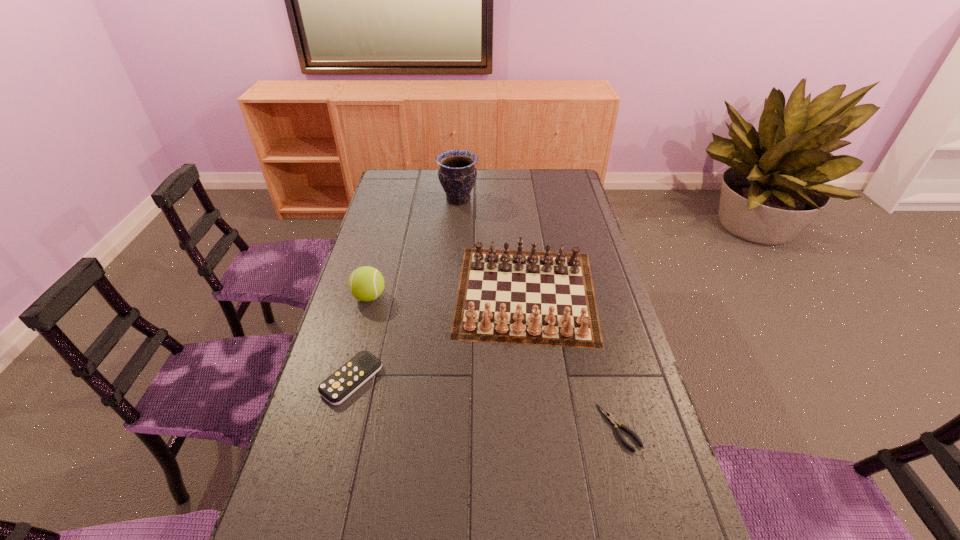
Locate an element on the screen. The height and width of the screenshot is (540, 960). vacant space located 0.080m on the back of the shortest object is located at coordinates (607, 379).

At what (x,y) coordinates should I click in order to perform the action: click on object situated at the far edge. Please return your answer as a coordinate pair (x, y). This screenshot has width=960, height=540. Looking at the image, I should click on (457, 174).

Identify the location of tennis ball that is at the left edge. This screenshot has width=960, height=540. (366, 283).

Locate an element on the screen. The width and height of the screenshot is (960, 540). remote control located in the left edge section of the desktop is located at coordinates (352, 375).

Locate an element on the screen. This screenshot has height=540, width=960. chessboard that is positioned at the right edge is located at coordinates (540, 299).

This screenshot has width=960, height=540. I want to click on pliers that is at the right edge, so click(613, 421).

Locate an element on the screen. The image size is (960, 540). vacant space at the left edge is located at coordinates (404, 222).

You are a GUI agent. You are given a task and a screenshot of the screen. Output one action in this format:
    pyautogui.click(x=<x>, y=<y>)
    Task: Click on the free point at the right edge
    The image size is (960, 540).
    Given the screenshot: What is the action you would take?
    click(x=645, y=402)

In the image, there is a desktop. Identify the location of free space at the far left corner. [397, 179].

Identify the location of vacant region at the far right corner of the desktop. The width and height of the screenshot is (960, 540). (540, 169).